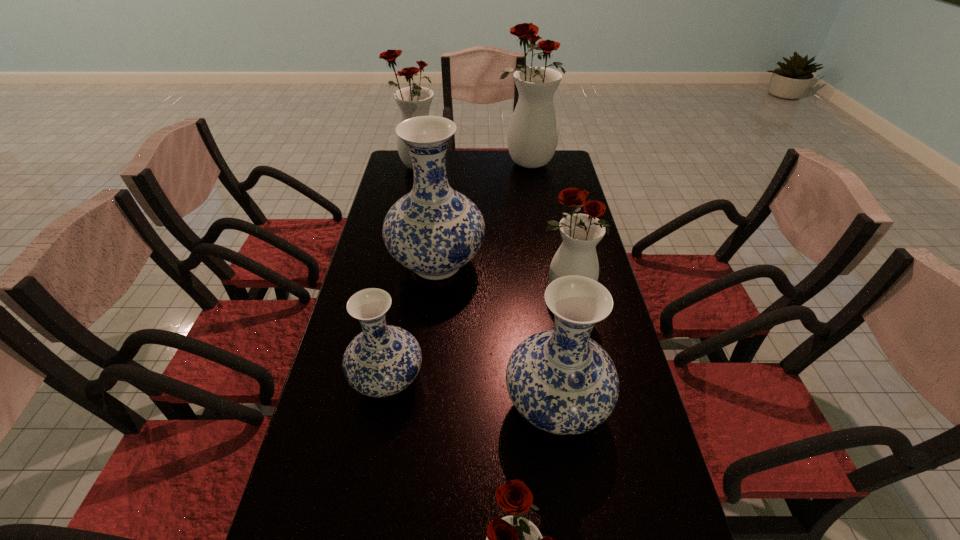
In order to click on vacant space situated 0.380m on the left of the third farthest red vase in this screenshot , I will do [x=408, y=292].

Locate an element on the screen. The width and height of the screenshot is (960, 540). free space located on the back of the rightmost blue vase is located at coordinates (540, 292).

Locate an element on the screen. free location located 0.180m on the back of the smallest blue vase is located at coordinates (402, 301).

Locate an element on the screen. The width and height of the screenshot is (960, 540). object at the far left corner is located at coordinates (415, 101).

Image resolution: width=960 pixels, height=540 pixels. What are the coordinates of `object that is positioned at the far right corner` in the screenshot? It's located at (532, 137).

The height and width of the screenshot is (540, 960). In the image, there is a desktop. What are the coordinates of `vacant area at the far edge` in the screenshot? It's located at (473, 178).

Image resolution: width=960 pixels, height=540 pixels. In the image, there is a desktop. In order to click on free space at the left edge in this screenshot , I will do `click(348, 403)`.

In the image, there is a desktop. In order to click on free space at the right edge in this screenshot , I will do `click(638, 403)`.

In order to click on free space at the far left corner in this screenshot , I will do pos(395,171).

You are a GUI agent. You are given a task and a screenshot of the screen. Output one action in this format:
    pyautogui.click(x=<x>, y=<y>)
    Task: Click on the vacant area that lies between the second biggest blue vase and the smallest blue vase
    This screenshot has height=540, width=960.
    Given the screenshot: What is the action you would take?
    pyautogui.click(x=471, y=393)